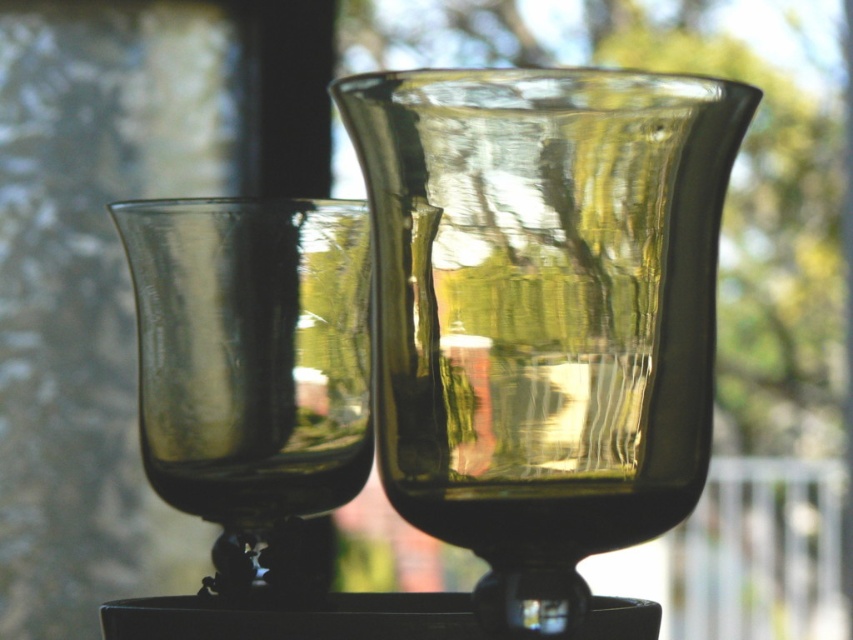
Question: Does transparent glass vase at center appear under transparent glass wine glass at center?

Choices:
 (A) yes
 (B) no

Answer: (B)

Question: Which point is closer to the camera taking this photo?

Choices:
 (A) (579, 417)
 (B) (134, 248)

Answer: (A)

Question: Which of the following is the farthest from the observer?

Choices:
 (A) (149, 477)
 (B) (393, 502)

Answer: (A)

Question: Can you confirm if transparent glass vase at center is thinner than transparent glass wine glass at center?

Choices:
 (A) yes
 (B) no

Answer: (B)

Question: Can you confirm if transparent glass vase at center is thinner than transparent glass wine glass at center?

Choices:
 (A) no
 (B) yes

Answer: (A)

Question: Which object appears farthest from the camera in this image?

Choices:
 (A) transparent glass wine glass at center
 (B) transparent glass vase at center

Answer: (A)